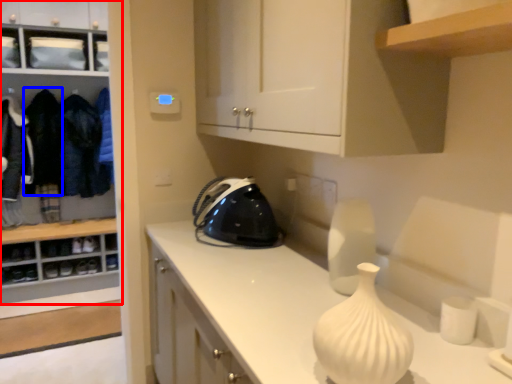
Question: Which of the following is the closest to the observer, cabinetry (highlighted by a red box) or clothing (highlighted by a blue box)?

Choices:
 (A) cabinetry
 (B) clothing

Answer: (A)